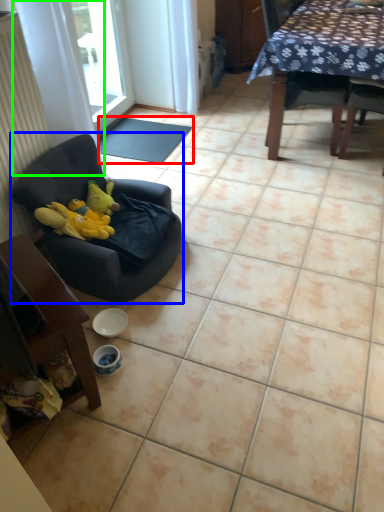
Question: Estimate the real-world distances between objects in this image. Which object is farther from mat (highlighted by a red box), chair (highlighted by a blue box) or curtain (highlighted by a green box)?

Choices:
 (A) chair
 (B) curtain

Answer: (A)